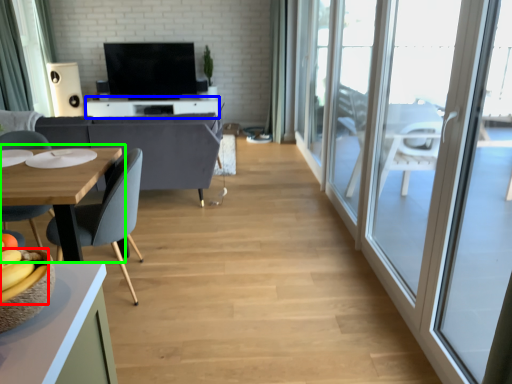
Question: Based on their relative distances, which object is farther from banana (highlighted by a red box)? Choose from table (highlighted by a blue box) and table (highlighted by a green box).

Choices:
 (A) table
 (B) table

Answer: (A)